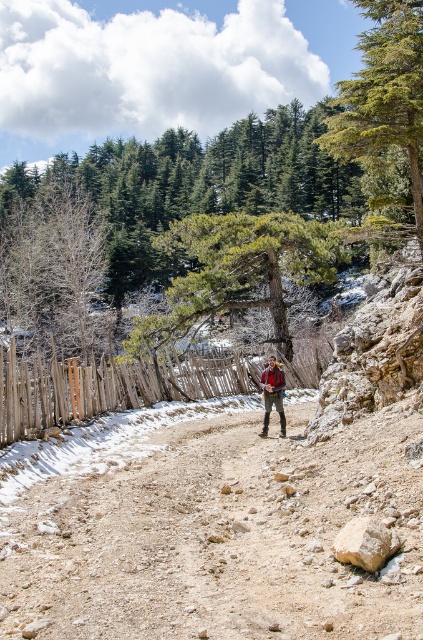
Question: Which of the following is the farthest from the observer?

Choices:
 (A) wooden at center
 (B) dusty gravel path at center
 (C) camouflage fabric backpack at center
 (D) green textured pine tree at center

Answer: (D)

Question: Which object is positioned farthest from the green textured pine tree at center?

Choices:
 (A) camouflage fabric backpack at center
 (B) wooden at center
 (C) green textured tree at upper right
 (D) dusty gravel path at center

Answer: (D)

Question: Does wooden at center appear on the left side of camouflage fabric backpack at center?

Choices:
 (A) no
 (B) yes

Answer: (B)

Question: Among these objects, which one is nearest to the camera?

Choices:
 (A) camouflage fabric backpack at center
 (B) green textured tree at upper right

Answer: (B)

Question: Is wooden at center closer to the viewer compared to camouflage fabric backpack at center?

Choices:
 (A) no
 (B) yes

Answer: (B)

Question: Is wooden at center to the left of camouflage fabric backpack at center from the viewer's perspective?

Choices:
 (A) no
 (B) yes

Answer: (B)